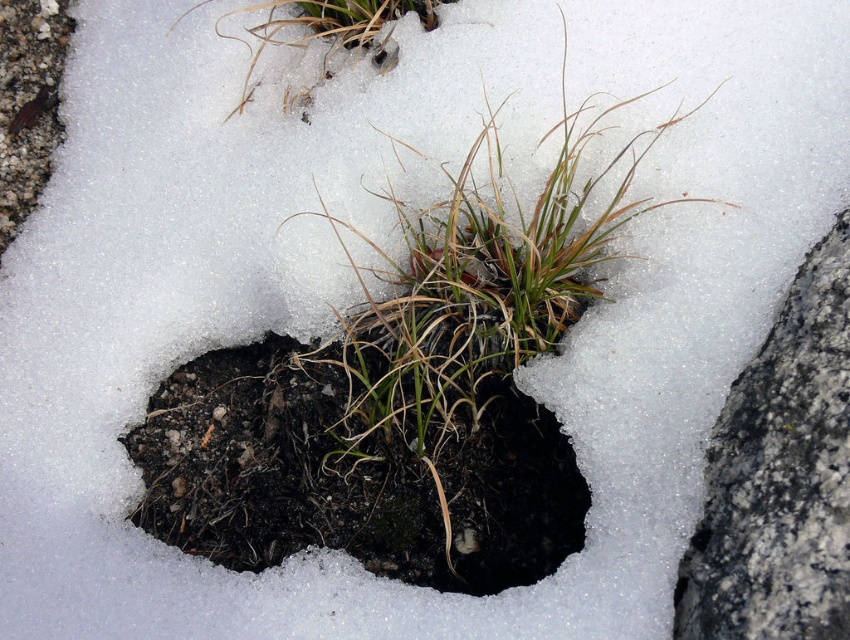
Which is in front, point (820, 419) or point (435, 10)?

Point (820, 419) is more forward.

I want to click on gray rough rock at right, so click(x=780, y=476).

Is the position of dull brown soil at center less distant than that of green grass at center?

No, dull brown soil at center is behind green grass at center.

You are a GUI agent. You are given a task and a screenshot of the screen. Output one action in this format:
    pyautogui.click(x=<x>, y=<y>)
    Task: Click on the dull brown soil at center
    
    Given the screenshot: What is the action you would take?
    pyautogui.click(x=350, y=474)

How far apart are dull brown soil at center and dry grass at upper center?

21.92 inches

Describe the element at coordinates (350, 474) in the screenshot. I see `dull brown soil at center` at that location.

Where is `dull brown soil at center`? The width and height of the screenshot is (850, 640). dull brown soil at center is located at coordinates (350, 474).

Where is `dull brown soil at center`? The height and width of the screenshot is (640, 850). dull brown soil at center is located at coordinates (350, 474).